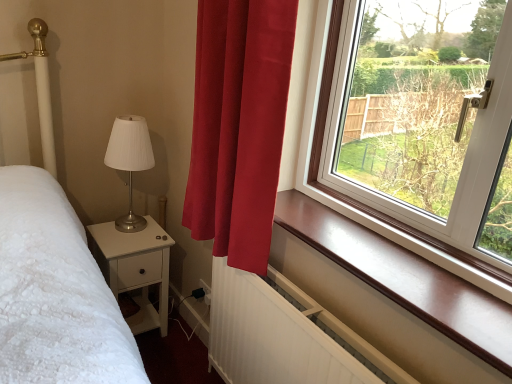
Question: Should I look upward or downward to see matte silver table lamp at left?

Choices:
 (A) down
 (B) up

Answer: (B)

Question: Considering the relative positions of brown polished wood at upper right and satin red curtain at center in the image provided, is brown polished wood at upper right to the right of satin red curtain at center from the viewer's perspective?

Choices:
 (A) no
 (B) yes

Answer: (B)

Question: Does brown polished wood at upper right have a lesser height compared to satin red curtain at center?

Choices:
 (A) yes
 (B) no

Answer: (A)

Question: Is brown polished wood at upper right far away from satin red curtain at center?

Choices:
 (A) no
 (B) yes

Answer: (A)

Question: Is satin red curtain at center surrounded by brown polished wood at upper right?

Choices:
 (A) yes
 (B) no

Answer: (B)

Question: Is brown polished wood at upper right bigger than satin red curtain at center?

Choices:
 (A) yes
 (B) no

Answer: (B)

Question: Is brown polished wood at upper right placed right next to satin red curtain at center?

Choices:
 (A) yes
 (B) no

Answer: (B)

Question: Is matte silver table lamp at left oriented towards white matte nightstand at lower left?

Choices:
 (A) no
 (B) yes

Answer: (A)

Question: Is matte silver table lamp at left with white matte nightstand at lower left?

Choices:
 (A) yes
 (B) no

Answer: (B)

Question: Is matte silver table lamp at left positioned with its back to white matte nightstand at lower left?

Choices:
 (A) no
 (B) yes

Answer: (A)

Question: From a real-world perspective, is matte silver table lamp at left below white matte nightstand at lower left?

Choices:
 (A) yes
 (B) no

Answer: (B)

Question: Does matte silver table lamp at left appear on the right side of white matte nightstand at lower left?

Choices:
 (A) yes
 (B) no

Answer: (A)

Question: Does matte silver table lamp at left have a larger size compared to white matte nightstand at lower left?

Choices:
 (A) no
 (B) yes

Answer: (A)

Question: Is white matte nightstand at lower left wider than matte silver table lamp at left?

Choices:
 (A) yes
 (B) no

Answer: (A)